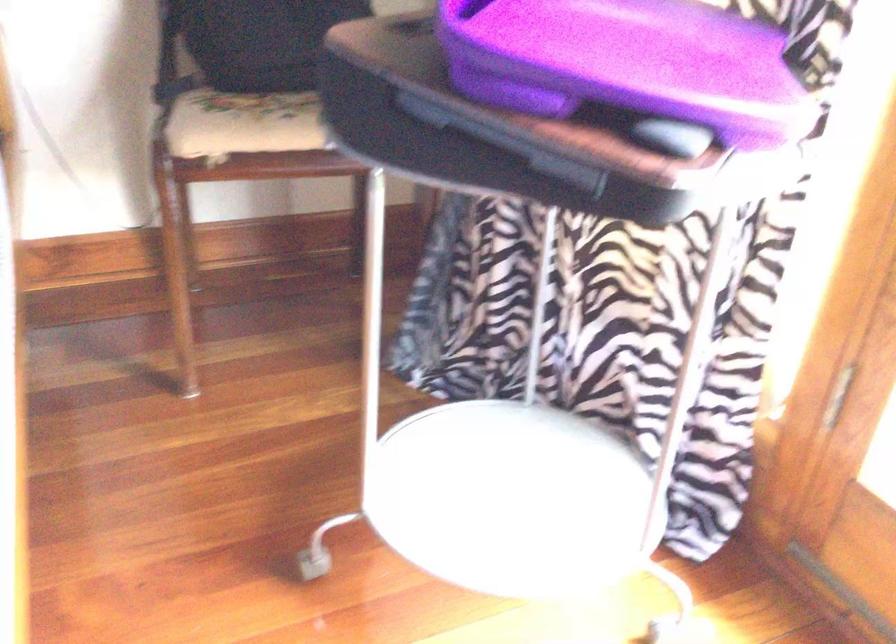
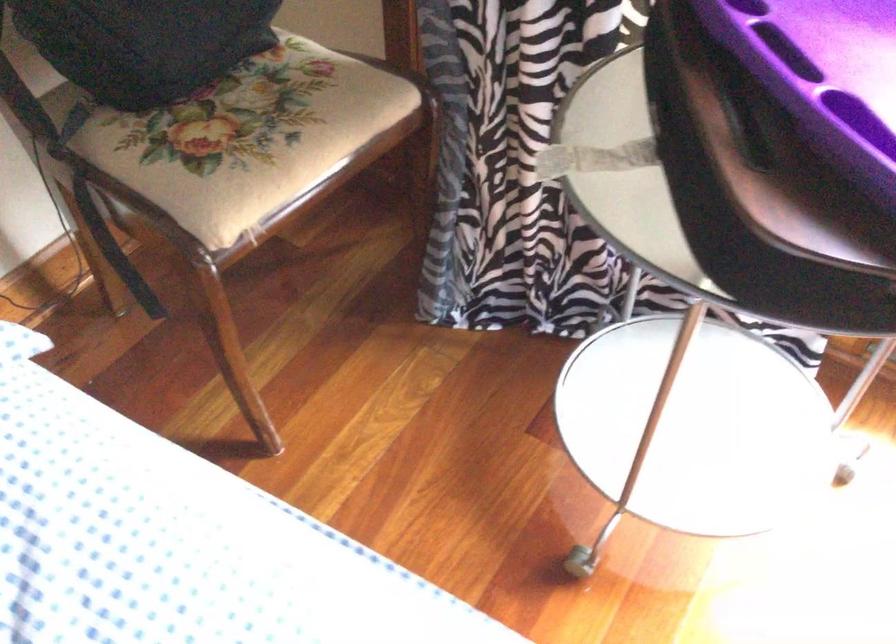
Find the pixel in the second image that matches the point at 263,111 in the first image.

(259, 145)